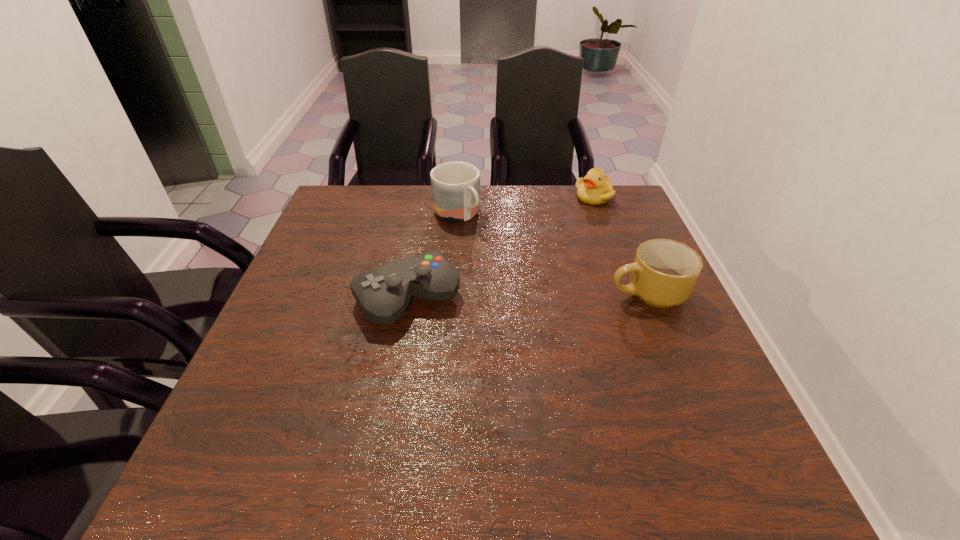
This screenshot has width=960, height=540. Identify the location of control. (383, 294).

In order to click on the nearer mug in this screenshot , I will do `click(664, 272)`.

Locate an element on the screen. This screenshot has height=540, width=960. the shorter mug is located at coordinates (664, 272).

Image resolution: width=960 pixels, height=540 pixels. I want to click on duckling, so pyautogui.click(x=595, y=188).

The image size is (960, 540). What are the coordinates of `the tallest object` in the screenshot? It's located at point(455,185).

The image size is (960, 540). What are the coordinates of `the farther mug` in the screenshot? It's located at pos(455,185).

At what (x,y) coordinates should I click in order to perform the action: click on vacant space situated on the right of the control. Please return your answer as a coordinate pair (x, y). This screenshot has height=540, width=960. Looking at the image, I should click on (609, 298).

At what (x,y) coordinates should I click in order to perform the action: click on vacant area located 0.260m on the side with the handle of the right mug. Please return your answer as a coordinate pair (x, y). Looking at the image, I should click on (498, 293).

Find the location of `free point located on the side with the handle of the right mug`. free point located on the side with the handle of the right mug is located at coordinates (490, 293).

I want to click on free region located 0.160m on the side with the handle of the right mug, so click(540, 293).